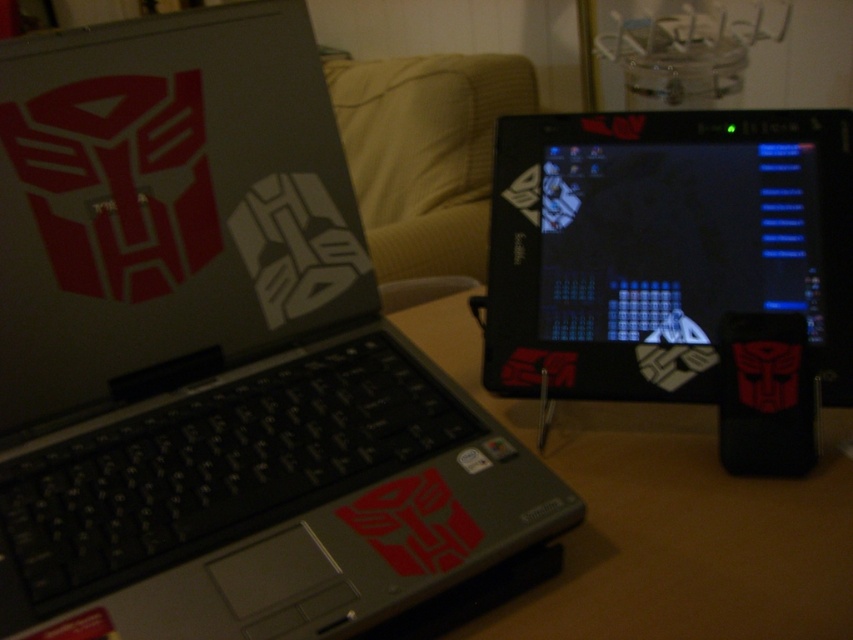
Based on the photo, you are organizing a tech event and need to place two matte black laptops on a table. The matte black laptop at left and the matte black laptop at center must be spaced according to the image. If the minimum required distance between them is 1.1 meters for safety, will the current spacing in the image meet this requirement?

The matte black laptop at left is 1.13 meters from the matte black laptop at center, which exceeds the 1.1 meter minimum requirement, so the spacing in the image meets the safety requirement.

You are trying to determine the best path to move a small object from one point to another on the desk without moving the laptops. The points are point (288, 516) and point (457, 140). Which point is closer to you so you can start moving the object from there?

Point (288, 516) is closer to the viewer than point (457, 140), so you should start moving the object from point (288, 516).

You are organizing a tech event and need to set up a demo station. You have a matte black laptop at left and a brown wooden table at center. Which object is closer to the viewer?

The matte black laptop at left is closer to the viewer because it is in front of the brown wooden table at center.